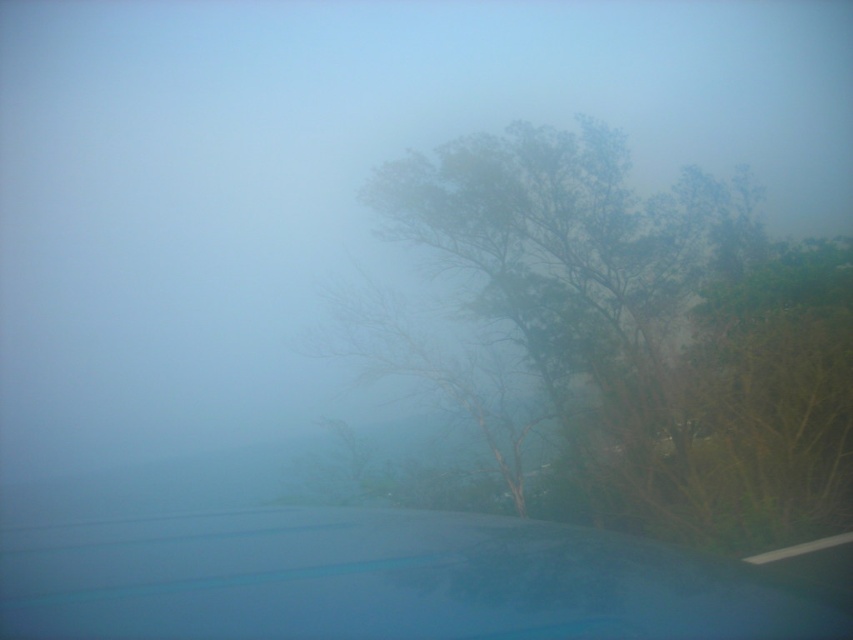
Question: Among these points, which one is farthest from the camera?

Choices:
 (A) (9, 544)
 (B) (727, 547)

Answer: (B)

Question: Does green matte tree at center appear on the right side of glossy blue car window at lower center?

Choices:
 (A) no
 (B) yes

Answer: (B)

Question: Is green matte tree at center wider than glossy blue car window at lower center?

Choices:
 (A) no
 (B) yes

Answer: (B)

Question: Does green matte tree at center appear over glossy blue car window at lower center?

Choices:
 (A) no
 (B) yes

Answer: (B)

Question: Which point is farther from the camera taking this photo?

Choices:
 (A) (306, 547)
 (B) (781, 253)

Answer: (B)

Question: Which point is closer to the camera taking this photo?

Choices:
 (A) (271, 628)
 (B) (657, 252)

Answer: (A)